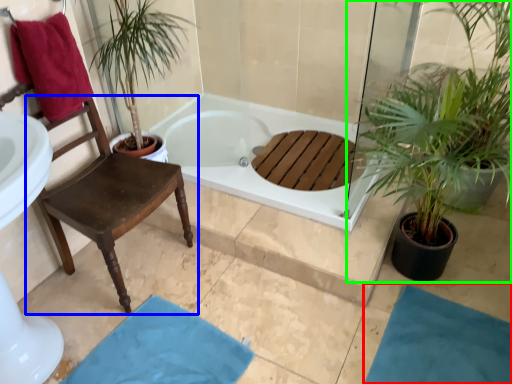
Question: Which object is positioned closest to bath mat (highlighted by a red box)? Select from chair (highlighted by a blue box) and houseplant (highlighted by a green box).

Choices:
 (A) chair
 (B) houseplant

Answer: (B)